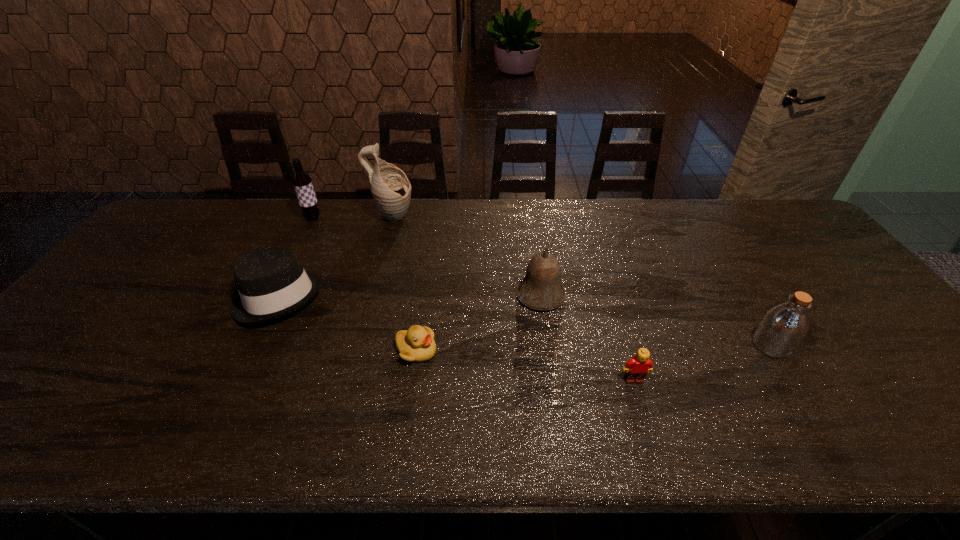
I want to click on vacant region located 0.120m at the spout of the fifth object from right to left, so pyautogui.click(x=450, y=217).

Locate an element on the screen. This screenshot has height=540, width=960. free region located 0.260m on the left of the sixth shortest object is located at coordinates (227, 218).

You are a GUI agent. You are given a task and a screenshot of the screen. Output one action in this format:
    pyautogui.click(x=<x>, y=<y>)
    Task: Click on the vacant space located on the left of the bottle
    This screenshot has width=960, height=540.
    Given the screenshot: What is the action you would take?
    pyautogui.click(x=614, y=346)

Identify the location of free space located on the right of the fifth object from left to right. (653, 295).

Identify the location of free space located on the right of the third shortest object. (466, 296).

Image resolution: width=960 pixels, height=540 pixels. Identify the location of vacant area situated 0.120m on the face of the nearest object. (650, 435).

What are the coordinates of `vacant space situated on the front-facing side of the fourth object from left to right` in the screenshot? It's located at (527, 350).

You are a GUI agent. You are given a task and a screenshot of the screen. Output one action in this format:
    pyautogui.click(x=<x>, y=<y>)
    Task: Click on the pitcher that is at the far edge
    
    Given the screenshot: What is the action you would take?
    pyautogui.click(x=390, y=187)

Identify the location of root beer present at the far edge. The height and width of the screenshot is (540, 960). 302,182.

In the image, there is a desktop. What are the coordinates of `blank space at the far edge` in the screenshot? It's located at [434, 223].